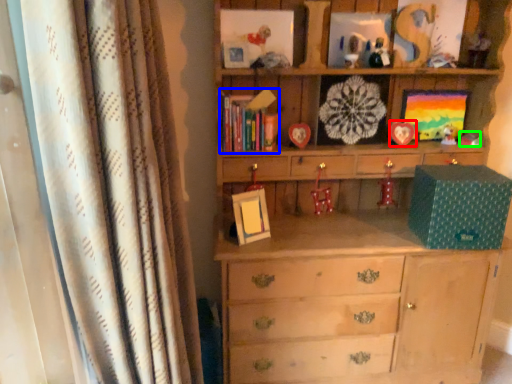
Question: Which object is positioned closest to picture frame (highlighted by a red box)? Select from book (highlighted by a blue box) and toy (highlighted by a green box).

Choices:
 (A) book
 (B) toy

Answer: (B)